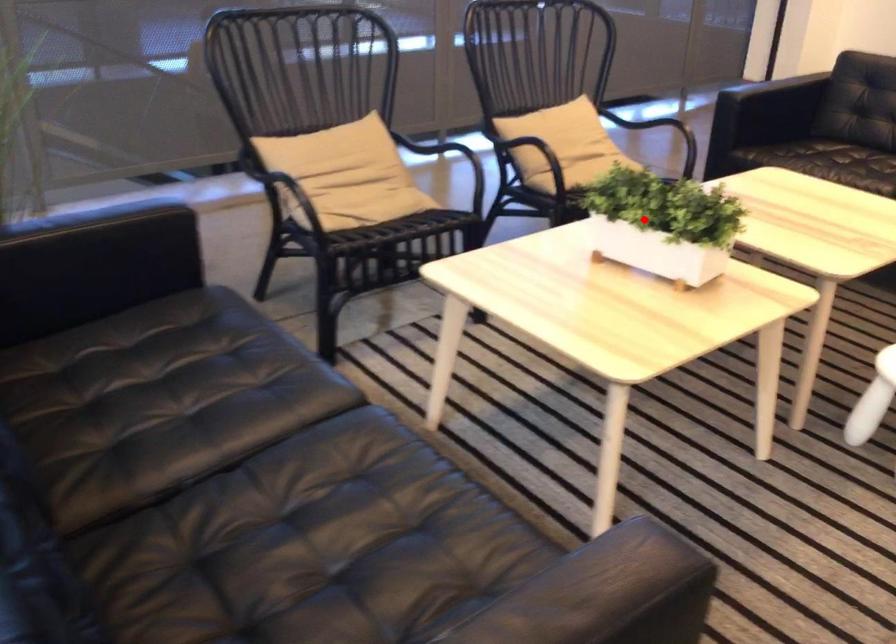
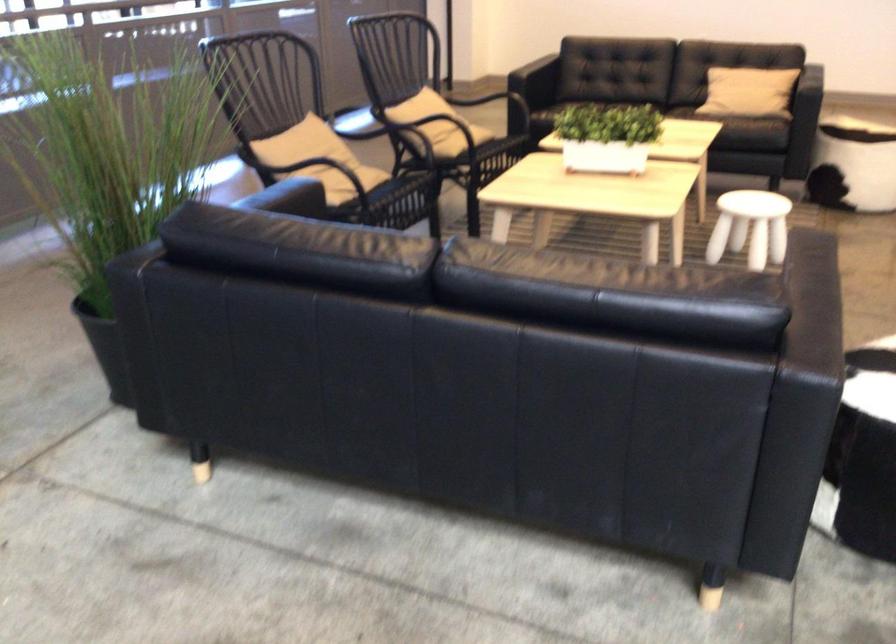
In the second image, find the point that corresponds to the highlighted location in the first image.

(607, 137)